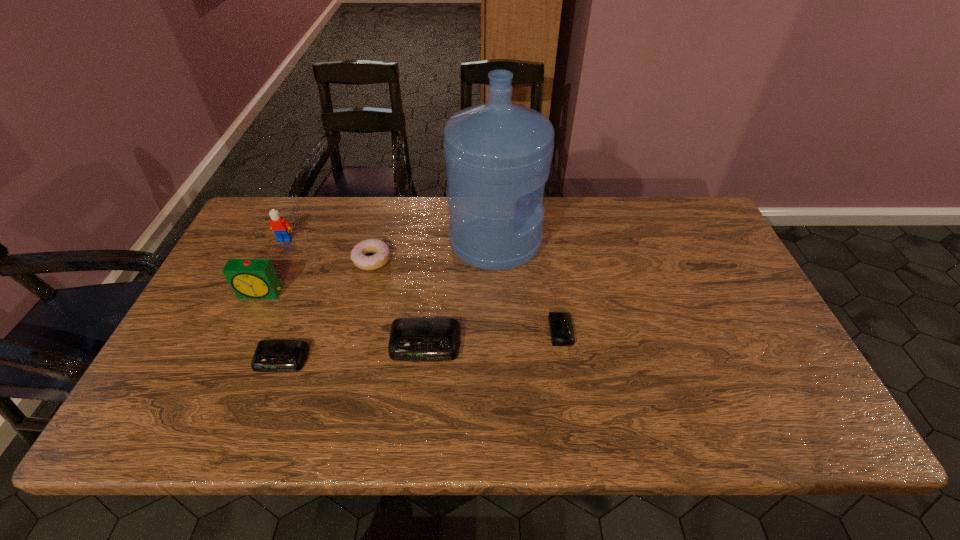
Find the location of `blank region between the fourth object from right to left and the tallest object`. blank region between the fourth object from right to left and the tallest object is located at coordinates (434, 250).

Where is `vacant space in between the fourth object from left to right and the tallest object`? vacant space in between the fourth object from left to right and the tallest object is located at coordinates (434, 250).

At what (x,y) coordinates should I click in order to perform the action: click on vacant space that is in between the water jug and the shortest alarm clock. Please return your answer as a coordinate pair (x, y). Looking at the image, I should click on (528, 286).

Locate an element on the screen. empty space between the shortest object and the second alarm clock from right to left is located at coordinates (493, 338).

Find the location of a particular element. This screenshot has height=540, width=960. free space between the Lego and the second alarm clock from right to left is located at coordinates 355,292.

You are a GUI agent. You are given a task and a screenshot of the screen. Output one action in this format:
    pyautogui.click(x=<x>, y=<y>)
    Task: Click on the empty space between the shortest object and the tallest object
    
    Given the screenshot: What is the action you would take?
    pyautogui.click(x=528, y=286)

The width and height of the screenshot is (960, 540). I want to click on object that is the second nearest to the shortest object, so click(x=411, y=339).

Locate which object is the third closest to the second shortest object. Please provide its 2D coordinates. Your answer should be formatted as a tuple, i.e. [(x, y)], where the tuple contains the x and y coordinates of a point satisfying the conditions above.

[(382, 250)]

Select which alarm clock is the closest to the shortest alarm clock. Please provide its 2D coordinates. Your answer should be formatted as a tuple, i.e. [(x, y)], where the tuple contains the x and y coordinates of a point satisfying the conditions above.

[(411, 339)]

This screenshot has width=960, height=540. Find the location of `the closest alarm clock relative to the tallest alarm clock`. the closest alarm clock relative to the tallest alarm clock is located at coordinates (270, 355).